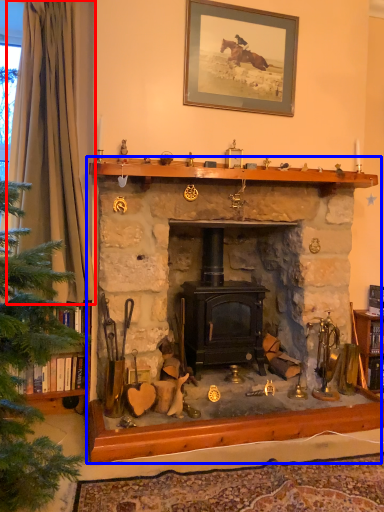
Question: Which of the following is the farthest to the observer, curtain (highlighted by a red box) or fireplace (highlighted by a blue box)?

Choices:
 (A) curtain
 (B) fireplace

Answer: (A)